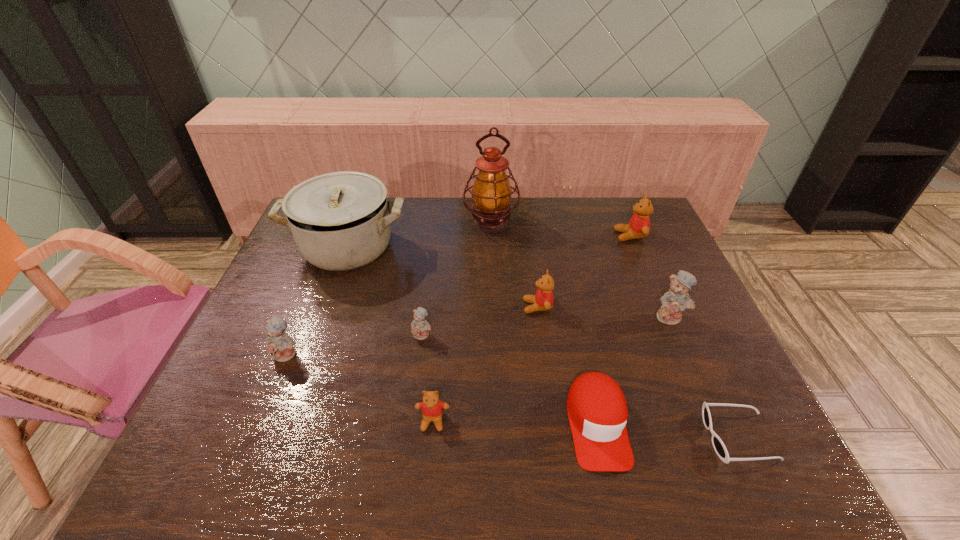
Find the location of a particular element. This screenshot has height=540, width=960. vacant area situated 0.190m with the lenses of the shortest object facing outward is located at coordinates (616, 437).

The width and height of the screenshot is (960, 540). What are the coordinates of `vacant space located with the lenses of the shortest object facing outward` in the screenshot? It's located at (521, 437).

Image resolution: width=960 pixels, height=540 pixels. I want to click on free space located 0.270m with the lenses of the shortest object facing outward, so click(x=578, y=437).

You are a GUI agent. You are given a task and a screenshot of the screen. Output one action in this format:
    pyautogui.click(x=<x>, y=<y>)
    Task: Click on the oil lamp that is at the far edge
    The image size is (960, 540).
    Given the screenshot: What is the action you would take?
    pyautogui.click(x=491, y=193)

Where is `saucepan that is at the far edge`? This screenshot has width=960, height=540. saucepan that is at the far edge is located at coordinates (340, 221).

Locate an element on the screen. This screenshot has width=960, height=540. teddy bear that is at the far edge is located at coordinates (638, 227).

Identify the location of baseball cap that is at the near edge. (597, 410).

In order to click on sunglasses positioned at the near edge in this screenshot , I will do `click(718, 445)`.

The image size is (960, 540). I want to click on saucepan positioned at the left edge, so point(340,221).

Locate an element on the screen. The image size is (960, 540). teddy bear that is at the left edge is located at coordinates (278, 344).